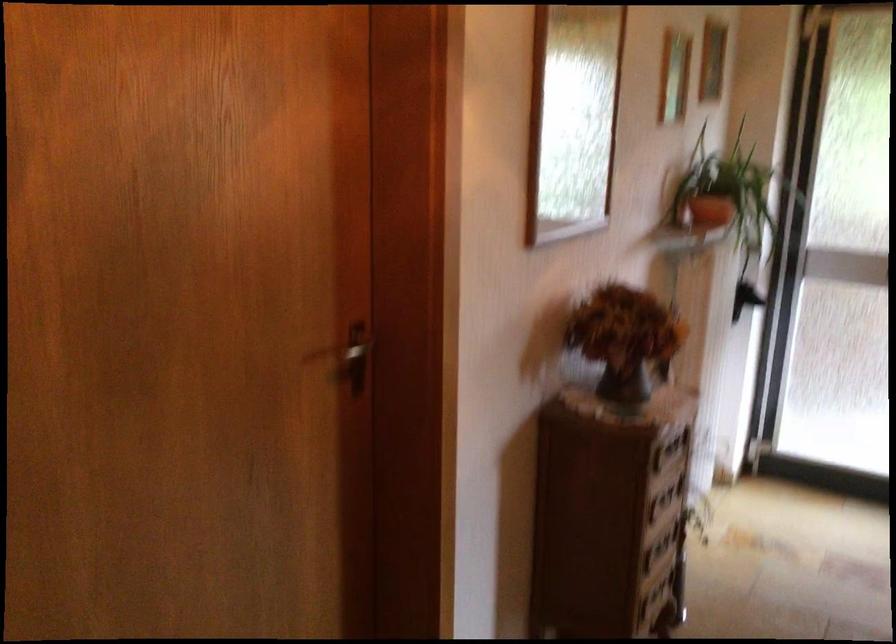
Where is `drawer pull handle`? The image size is (896, 644). drawer pull handle is located at coordinates (659, 504).